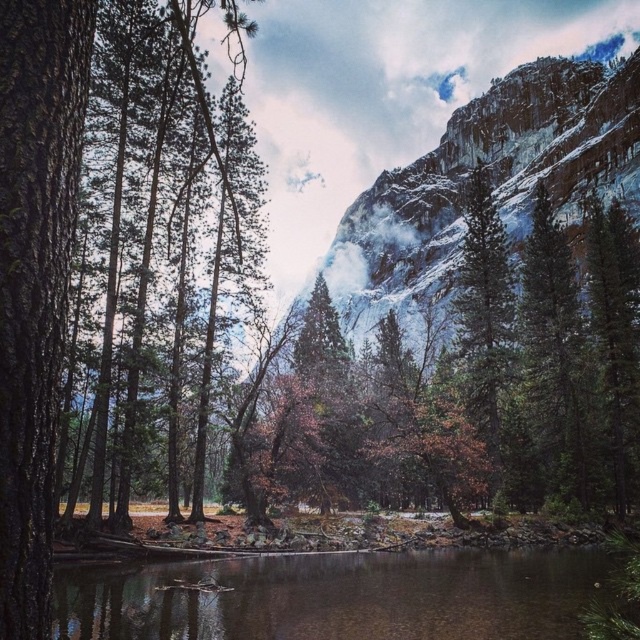
You are standing at the edge of the clear water at center and want to reach the green matte tree at right. Which direction should you walk to get there?

You should walk upwards towards the green matte tree at right because the clear water at center is below it.

You are standing in the forest and see the smooth bark tree at left and the green matte tree at left. Which tree is closer to you?

The smooth bark tree at left is closer to you because it is positioned under the green matte tree at left, meaning it is in front of it from your perspective.

Based on the photo, you are a hiker who needs to cross the clear water at center to reach the green matte tree at right. Given that your backpack has a 100 feet rope, can you safely use the rope to cross the water? Please explain your reasoning.

The clear water at center and green matte tree at right are 87.38 feet apart. Since the rope is 100 feet long, which is longer than the distance between them, you can safely use the rope to cross the water.